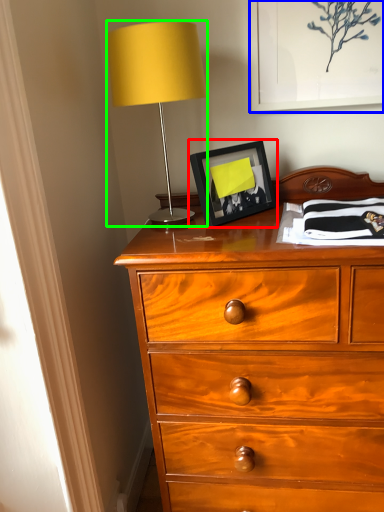
Question: Estimate the real-world distances between objects in this image. Which object is farther from picture frame (highlighted by a red box), picture frame (highlighted by a blue box) or table lamp (highlighted by a green box)?

Choices:
 (A) picture frame
 (B) table lamp

Answer: (A)